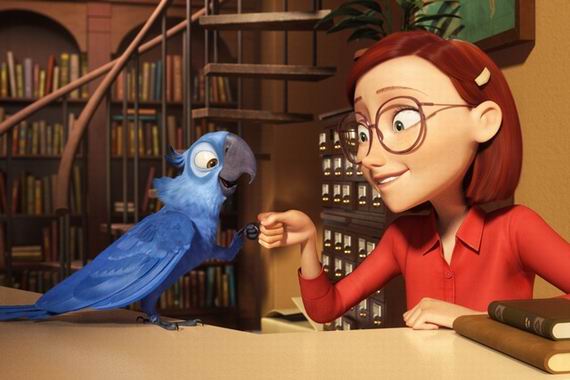
This screenshot has width=570, height=380. I want to click on book shelves, so click(x=146, y=134), click(x=35, y=138).